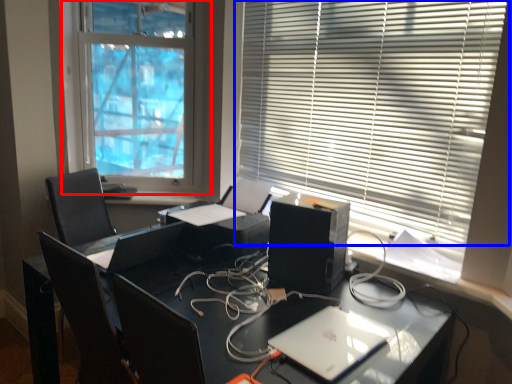
Question: Among these objects, which one is nearest to the camera, window blind (highlighted by a red box) or window blind (highlighted by a blue box)?

Choices:
 (A) window blind
 (B) window blind

Answer: (B)